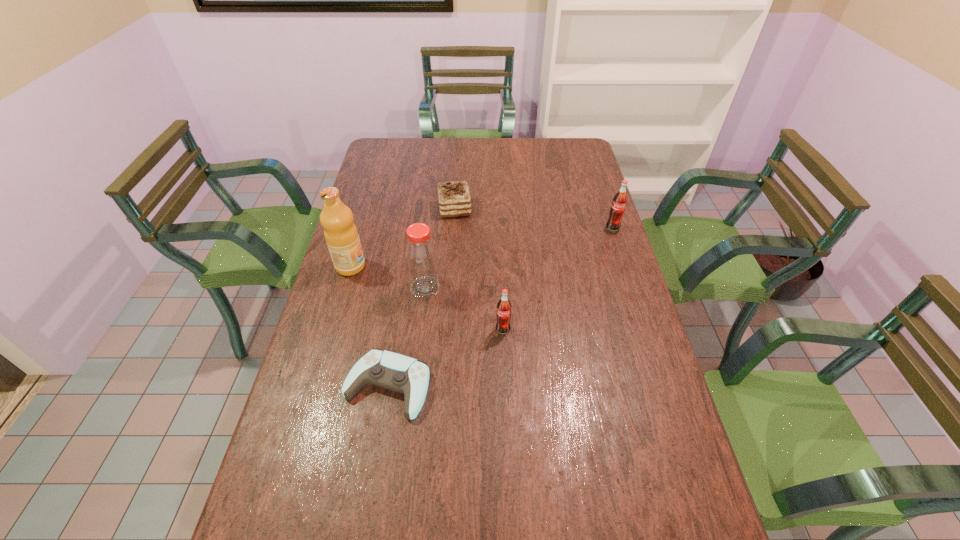
Find the location of `vacant space at the left edge of the desktop`. vacant space at the left edge of the desktop is located at coordinates (391, 187).

Identify the location of vacant space at the right edge of the desktop. The image size is (960, 540). (596, 215).

In the image, there is a desktop. Find the location of `vacant space at the near left corner`. vacant space at the near left corner is located at coordinates (273, 509).

Find the location of a particular element. blank space at the far right corner of the desktop is located at coordinates (557, 161).

Locate an element on the screen. Image resolution: width=960 pixels, height=540 pixels. empty space between the control and the second nearest object is located at coordinates (445, 357).

You are a GUI agent. You are given a task and a screenshot of the screen. Output one action in this format:
    pyautogui.click(x=<x>, y=<y>)
    Task: Click on the free space between the third shortest object and the second tallest object
    Image resolution: width=960 pixels, height=540 pixels.
    Given the screenshot: What is the action you would take?
    point(464,308)

You are a GUI agent. You are given a task and a screenshot of the screen. Output one action in this format:
    pyautogui.click(x=<x>, y=<y>)
    Task: Click on the free space between the taller soda bottle and the bottle
    The width and height of the screenshot is (960, 540).
    Given the screenshot: What is the action you would take?
    pyautogui.click(x=519, y=258)

This screenshot has height=540, width=960. In order to click on free spot between the bottle and the third tallest object in this screenshot , I will do `click(519, 258)`.

You are a GUI agent. You are given a task and a screenshot of the screen. Output one action in this format:
    pyautogui.click(x=<x>, y=<y>)
    Task: Click on the vacant area between the bottle and the nearer soda bottle
    This screenshot has width=960, height=540.
    Given the screenshot: What is the action you would take?
    pyautogui.click(x=464, y=308)

Image resolution: width=960 pixels, height=540 pixels. In order to click on free spot between the fourth shortest object and the nearer soda bottle in this screenshot , I will do `click(558, 279)`.